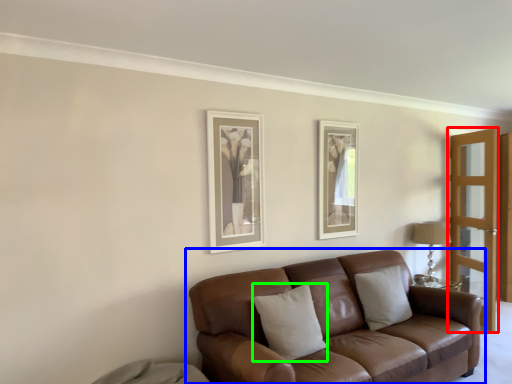
Question: Estimate the real-world distances between objects in this image. Which object is farther from screen door (highlighted by a red box), studio couch (highlighted by a blue box) or pillow (highlighted by a green box)?

Choices:
 (A) studio couch
 (B) pillow

Answer: (B)